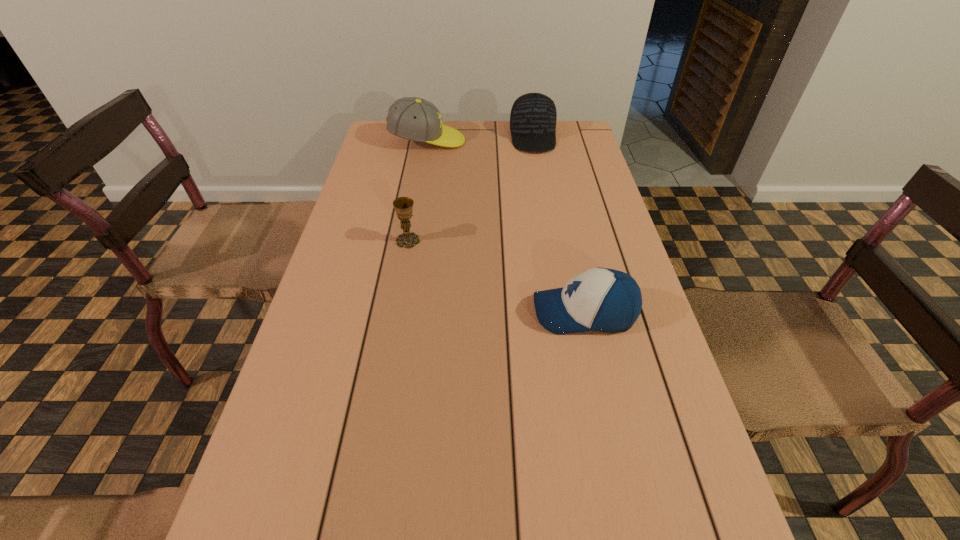
I want to click on the leftmost baseball cap, so click(x=412, y=118).

Locate an element on the screen. the second nearest object is located at coordinates [x=403, y=206].

Locate an element on the screen. the nearest baseball cap is located at coordinates (600, 299).

The image size is (960, 540). What are the coordinates of `the nearest object` in the screenshot? It's located at (600, 299).

This screenshot has height=540, width=960. I want to click on vacant space located 0.110m on the front-facing side of the leftmost baseball cap, so click(496, 141).

The image size is (960, 540). Identify the location of vacant area situated on the front of the third farthest object. (387, 360).

You are a GUI agent. You are given a task and a screenshot of the screen. Output one action in this format:
    pyautogui.click(x=<x>, y=<y>)
    Task: Click on the blank space located 0.330m on the front-facing side of the nearest baseball cap
    
    Given the screenshot: What is the action you would take?
    pyautogui.click(x=383, y=313)

Find the location of a particular element. vacant area situated 0.220m on the front-facing side of the nearest baseball cap is located at coordinates (433, 313).

I want to click on vacant region located on the front-facing side of the nearest baseball cap, so click(x=351, y=313).

Locate an element on the screen. baseball cap situated at the left edge is located at coordinates (412, 118).